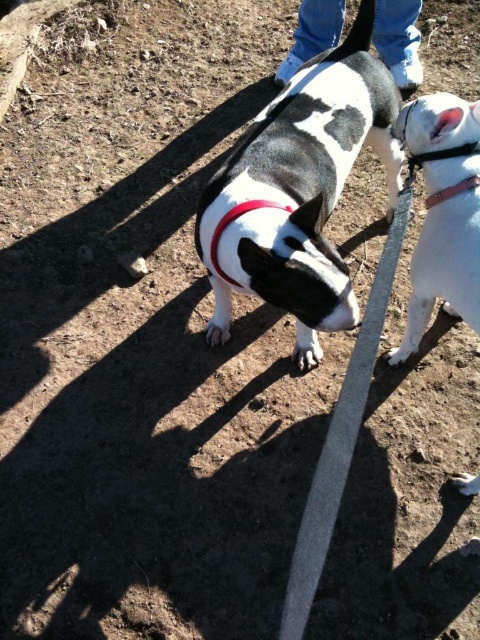
You are a dog owner trying to identify your dog in a photo. You have a dog with a red leather collar at center. There is also a black and white fur at center. Which object is wider in the image?

The black and white fur at center is wider than the red leather collar at center according to the description.

You are a dog trainer observing the scene. You need to determine which object is taller between the white matte dog at center and the red leather neckband at upper right. Based on the scene, which one is taller?

The white matte dog at center is much taller than the red leather neckband at upper right, so the white matte dog at center is taller.